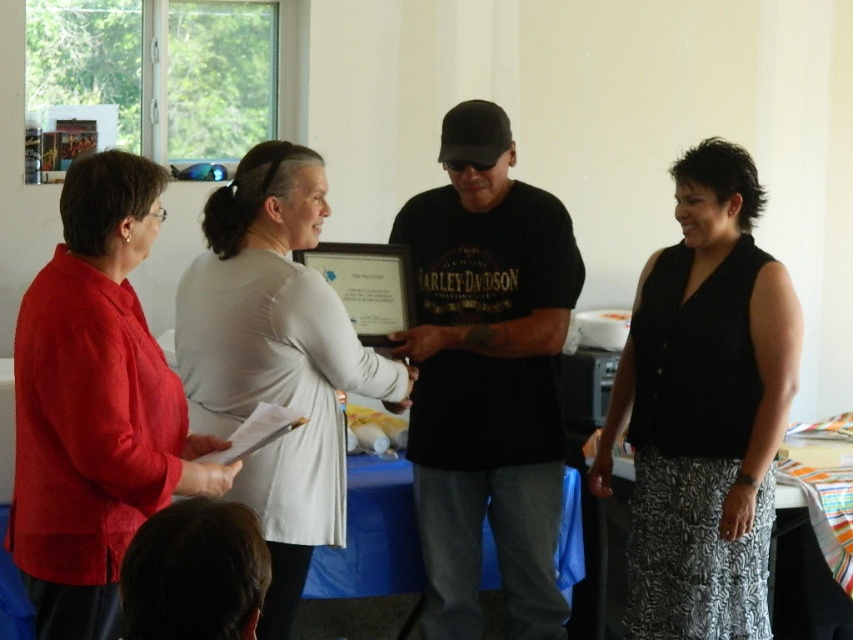
From the picture: Based on the scene description, which object is taller between the black knit vest at right and the white fabric at center?

The black knit vest at right is much taller than the white fabric at center.

Based on the scene description, which object is positioned in front of the other between the white fabric at center and the black knit vest at right?

The black knit vest at right is in front of the white fabric at center because the white fabric at center is behind it.